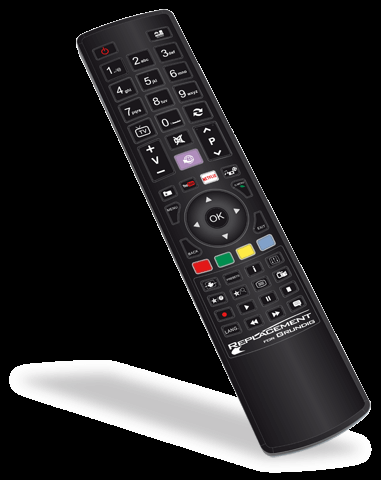
The image size is (381, 480). Identify the location of number buttons on tv remote control. (116, 71), (169, 53), (143, 56), (175, 72), (147, 78), (126, 86), (126, 108), (159, 101), (186, 93), (169, 118).